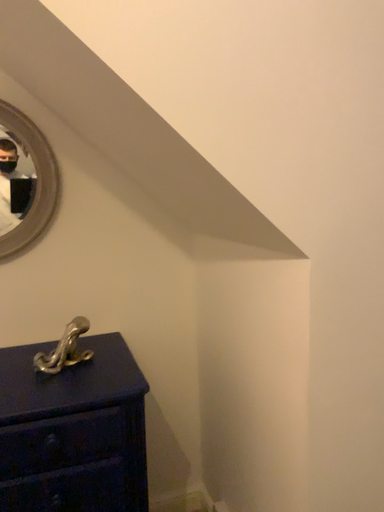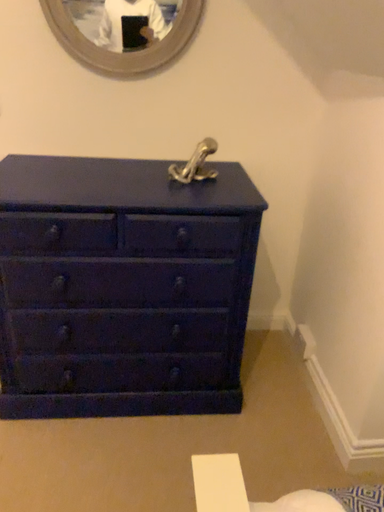
Question: Which way did the camera rotate in the video?

Choices:
 (A) rotated downward
 (B) rotated upward

Answer: (A)